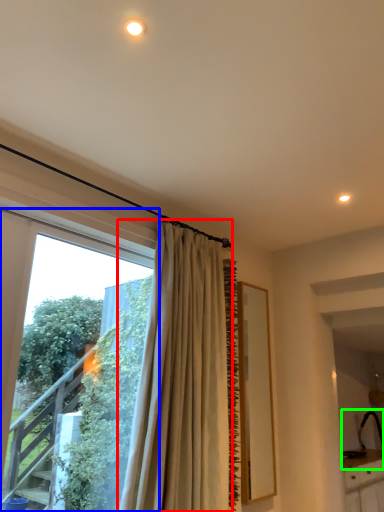
Question: Estimate the real-world distances between objects in this image. Which object is closer to curtain (highlighted by a red box), window (highlighted by a blue box) or sink (highlighted by a green box)?

Choices:
 (A) window
 (B) sink

Answer: (A)